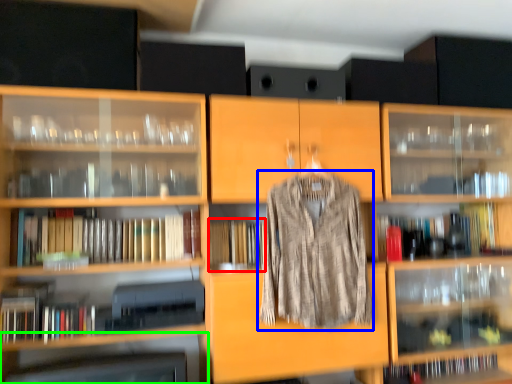
Question: Estimate the real-world distances between objects in this image. Which object is closer to book (highlighted by a red box), clothing (highlighted by a blue box) or shelf (highlighted by a green box)?

Choices:
 (A) clothing
 (B) shelf

Answer: (A)